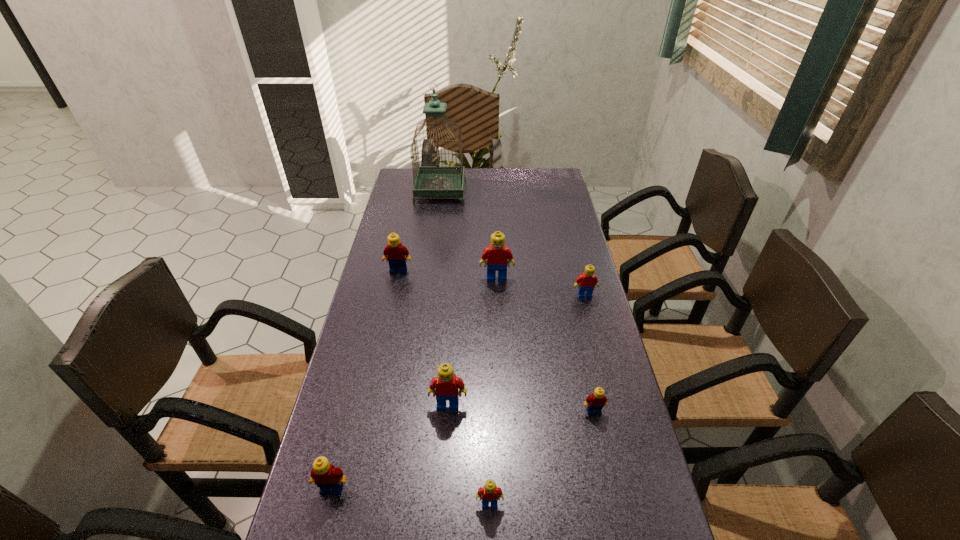
Select which object appears as the sixth closest to the second nearest yellow Lego. Please provide its 2D coordinates. Your answer should be formatted as a tuple, i.e. [(x, y)], where the tuple contains the x and y coordinates of a point satisfying the conditions above.

[(394, 252)]

Identify the location of the second closest Lego relative to the third farthest red Lego. Image resolution: width=960 pixels, height=540 pixels. (328, 478).

Point out which Lego is positioned as the nearest to the nearest object. Please provide its 2D coordinates. Your answer should be formatted as a tuple, i.e. [(x, y)], where the tuple contains the x and y coordinates of a point satisfying the conditions above.

[(446, 386)]

Where is `the second closest red Lego to the farthest red Lego`? This screenshot has width=960, height=540. the second closest red Lego to the farthest red Lego is located at coordinates (446, 386).

Identify which red Lego is located as the second nearest to the tallest object. Please provide its 2D coordinates. Your answer should be formatted as a tuple, i.e. [(x, y)], where the tuple contains the x and y coordinates of a point satisfying the conditions above.

[(586, 282)]

Where is `yellow Lego object that ranks as the closest to the second farthest yellow Lego`? yellow Lego object that ranks as the closest to the second farthest yellow Lego is located at coordinates (328, 478).

Where is `the second closest yellow Lego to the farthest yellow Lego`? the second closest yellow Lego to the farthest yellow Lego is located at coordinates (595, 402).

Where is `vacant region that satisfies the following two spatial constraints: 1. at the door of the farthest object; 2. on the front-facing side of the second smallest yellow Lego`? vacant region that satisfies the following two spatial constraints: 1. at the door of the farthest object; 2. on the front-facing side of the second smallest yellow Lego is located at coordinates (400, 489).